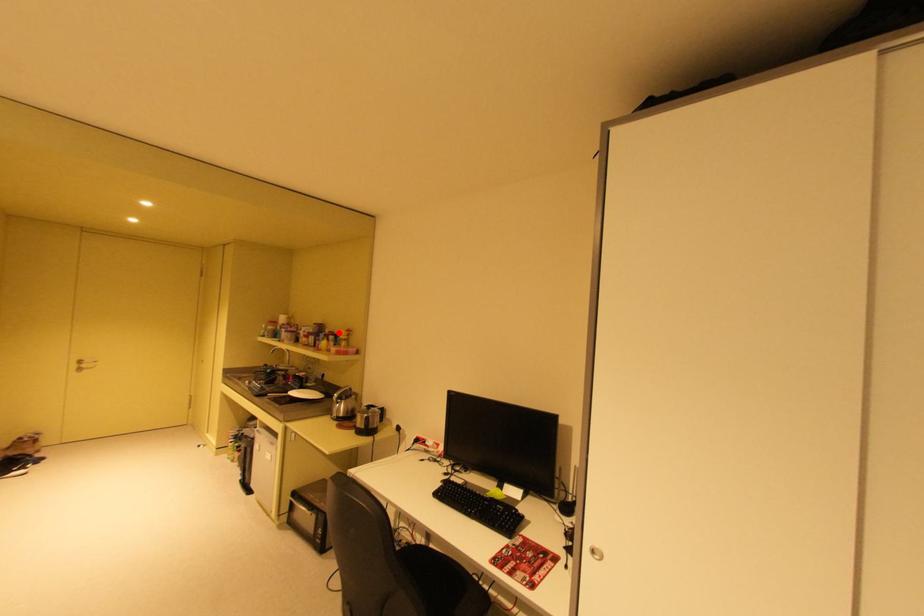
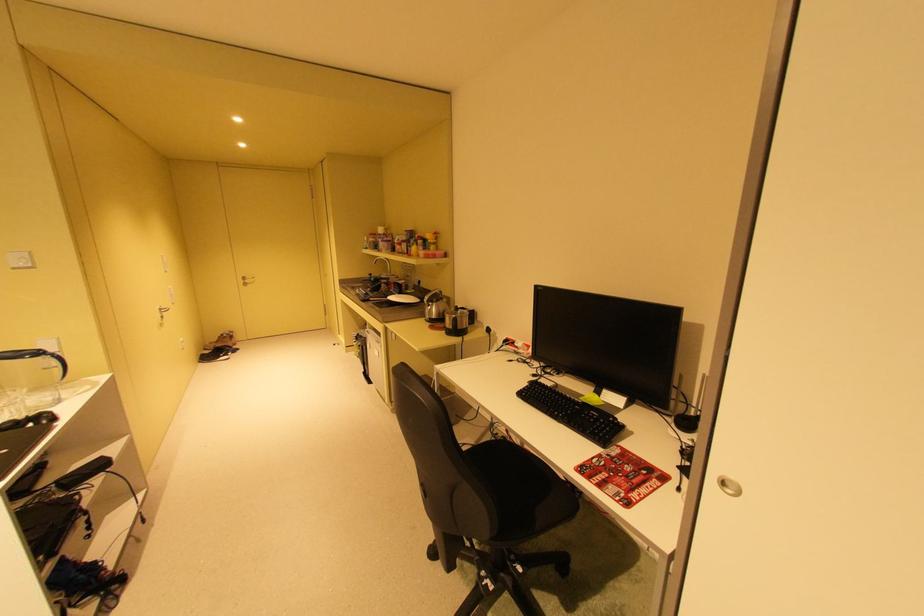
Find the pixel in the second image that matches the highlighted location in the first image.

(428, 237)